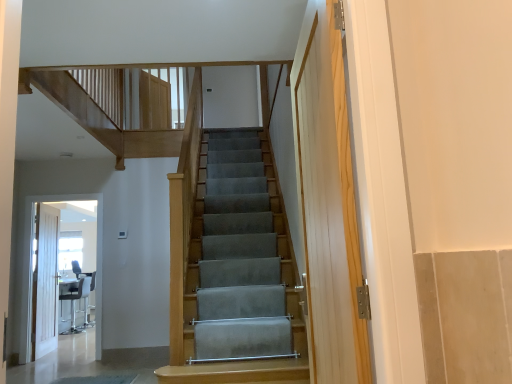
You are a GUI agent. You are given a task and a screenshot of the screen. Output one action in this format:
    pyautogui.click(x=<x>, y=<y>)
    Task: Click on the white glossy door at left
    
    Given the screenshot: What is the action you would take?
    pyautogui.click(x=96, y=243)

The image size is (512, 384). Describe the element at coordinates (46, 282) in the screenshot. I see `white painted wooden door at left` at that location.

Image resolution: width=512 pixels, height=384 pixels. I want to click on white glossy door at left, so click(96, 243).

From the image's perspective, which is above, white painted wooden door at left or white glossy door at left?

white glossy door at left appears higher in the image.

Which of these two, white painted wooden door at left or white glossy door at left, stands shorter?

With less height is white painted wooden door at left.

Is white painted wooden door at left outside of white glossy door at left?

Indeed, white painted wooden door at left is completely outside white glossy door at left.

Could you tell me if white painted wooden door at left is facing white glossy door at left?

No, white painted wooden door at left is not facing towards white glossy door at left.

Between white painted wooden door at left and matte black chair at lower left, which one has less height?

With less height is matte black chair at lower left.

Are white painted wooden door at left and matte black chair at lower left making contact?

white painted wooden door at left and matte black chair at lower left are clearly separated.

Is matte black chair at lower left inside white painted wooden door at left?

Definitely not — matte black chair at lower left is not inside white painted wooden door at left.

How different are the orientations of white painted wooden door at left and matte black chair at lower left in degrees?

170 degrees separate the facing orientations of white painted wooden door at left and matte black chair at lower left.

Is matte black chair at lower left positioned beyond the bounds of white glossy door at left?

Indeed, matte black chair at lower left is completely outside white glossy door at left.

This screenshot has height=384, width=512. In order to click on chair behind the white glossy door at left in this screenshot , I will do `click(78, 299)`.

Based on the photo, which object is further away from the camera, matte black chair at lower left or white glossy door at left?

matte black chair at lower left is behind.

From a real-world perspective, is matte black chair at lower left under white glossy door at left?

Correct, in the physical world, matte black chair at lower left is lower than white glossy door at left.

Can you tell me how much white glossy door at left and white painted wooden door at left differ in facing direction?

They differ by 94.2 degrees in their facing directions.

Is white glossy door at left touching white painted wooden door at left?

They are not placed beside each other.

From their relative heights in the image, would you say white glossy door at left is taller or shorter than white painted wooden door at left?

Considering their sizes, white glossy door at left has more height than white painted wooden door at left.

Based on their sizes in the image, would you say matte black chair at lower left is bigger or smaller than white painted wooden door at left?

Clearly, matte black chair at lower left is larger in size than white painted wooden door at left.

Is the position of matte black chair at lower left less distant than that of white painted wooden door at left?

No, it is behind white painted wooden door at left.

How different are the orientations of matte black chair at lower left and white painted wooden door at left in degrees?

The facing directions of matte black chair at lower left and white painted wooden door at left are 170 degrees apart.

Find the location of a particular element. This screenshot has width=512, height=384. door lying on the right of matte black chair at lower left is located at coordinates (46, 282).

You are a GUI agent. You are given a task and a screenshot of the screen. Output one action in this format:
    pyautogui.click(x=<x>, y=<y>)
    Task: Click on the chair located underneath the white glossy door at left (from a real-world perspective)
    This screenshot has width=512, height=384.
    Given the screenshot: What is the action you would take?
    pyautogui.click(x=78, y=299)

From a real-world perspective, which object rests below the other?

matte black chair at lower left.

Between white glossy door at left and matte black chair at lower left, which one has less height?

Standing shorter between the two is matte black chair at lower left.

Considering the relative sizes of white glossy door at left and matte black chair at lower left in the image provided, is white glossy door at left thinner than matte black chair at lower left?

Yes, white glossy door at left is thinner than matte black chair at lower left.

Where is `elevator that is on the right side of white painted wooden door at left`? The image size is (512, 384). elevator that is on the right side of white painted wooden door at left is located at coordinates (96, 243).

Image resolution: width=512 pixels, height=384 pixels. Identify the location of chair below the white painted wooden door at left (from the image's perspective). (78, 299).

Considering their positions, is white glossy door at left positioned closer to white painted wooden door at left than matte black chair at lower left?

white glossy door at left is positioned closer to the anchor white painted wooden door at left.

Considering their positions, is matte black chair at lower left positioned closer to white glossy door at left than white painted wooden door at left?

white painted wooden door at left lies closer to white glossy door at left than the other object.

From the picture: Estimate the real-world distances between objects in this image. Which object is closer to matte black chair at lower left, white painted wooden door at left or white glossy door at left?

Based on the image, white painted wooden door at left appears to be nearer to matte black chair at lower left.

When comparing their distances from white painted wooden door at left, does matte black chair at lower left or white glossy door at left seem further?

matte black chair at lower left is further to white painted wooden door at left.

Looking at the image, which one is located closer to white glossy door at left, white painted wooden door at left or matte black chair at lower left?

white painted wooden door at left is closer to white glossy door at left.

From the image, which object appears to be nearer to matte black chair at lower left, white glossy door at left or white painted wooden door at left?

white painted wooden door at left lies closer to matte black chair at lower left than the other object.

At what (x,y) coordinates should I click in order to perform the action: click on door between white glossy door at left and matte black chair at lower left in the front-back direction. Please return your answer as a coordinate pair (x, y). The height and width of the screenshot is (384, 512). Looking at the image, I should click on (46, 282).